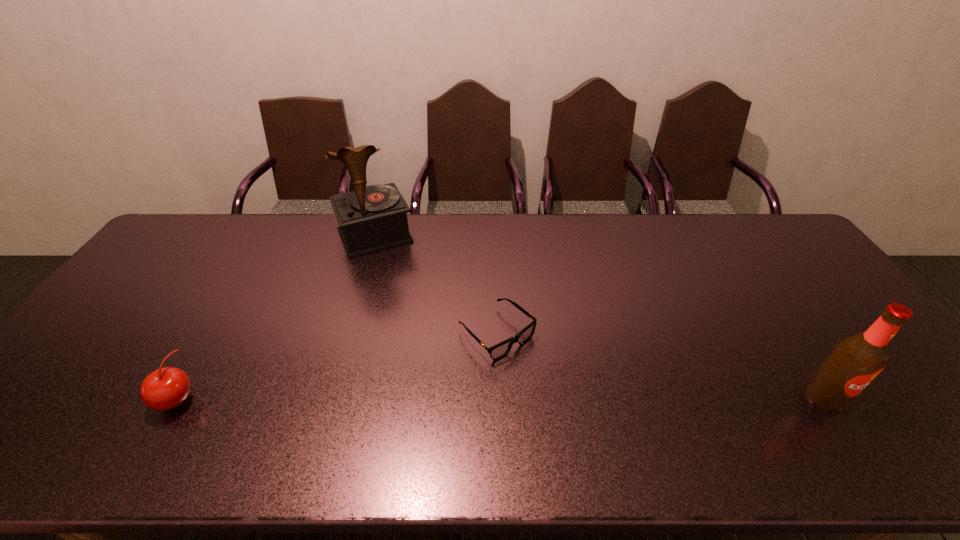
Identify the location of vacant space on the desktop that is between the second shortest object and the rightmost object and is positioned at the horn opening of the farthest object. (450, 398).

In order to click on free spot on the desktop that is between the third tallest object and the rightmost object and is positioned on the front-facing side of the sunglasses in this screenshot , I will do `click(565, 397)`.